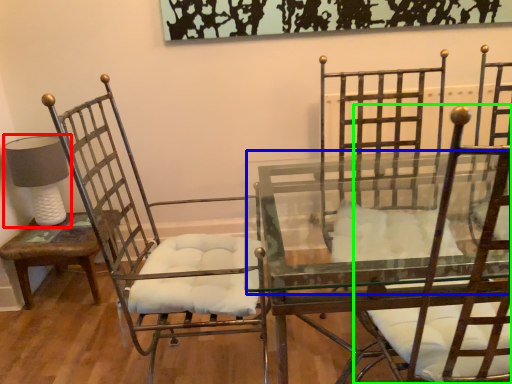
Question: Based on their relative distances, which object is farther from table lamp (highlighted by a red box)? Choose from round table (highlighted by a blue box) and chair (highlighted by a green box).

Choices:
 (A) round table
 (B) chair

Answer: (B)